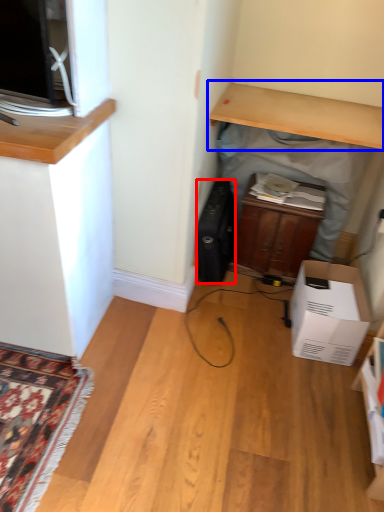
Question: Among these objects, which one is farthest to the camera, appliance (highlighted by a red box) or desk (highlighted by a blue box)?

Choices:
 (A) appliance
 (B) desk

Answer: (A)